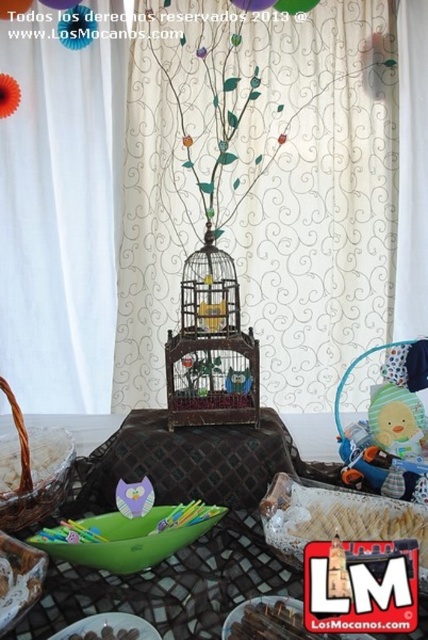
You are setting up a themed party and need to place a decorative item. You have a green plastic bowl at lower left. Where exactly should you place it in the coordinate system provided?

The green plastic bowl at lower left should be placed at coordinate point (269, 620).

You are setting up decorations for an event and need to place a small toy that requires 15 cm of space. You have the green plastic bowl at lower left and the purple paper balloon at upper center available. Which object can accommodate the toy based on their sizes?

The purple paper balloon at upper center has a larger size than the green plastic bowl at lower left, so it can accommodate the toy that requires 15 cm of space.